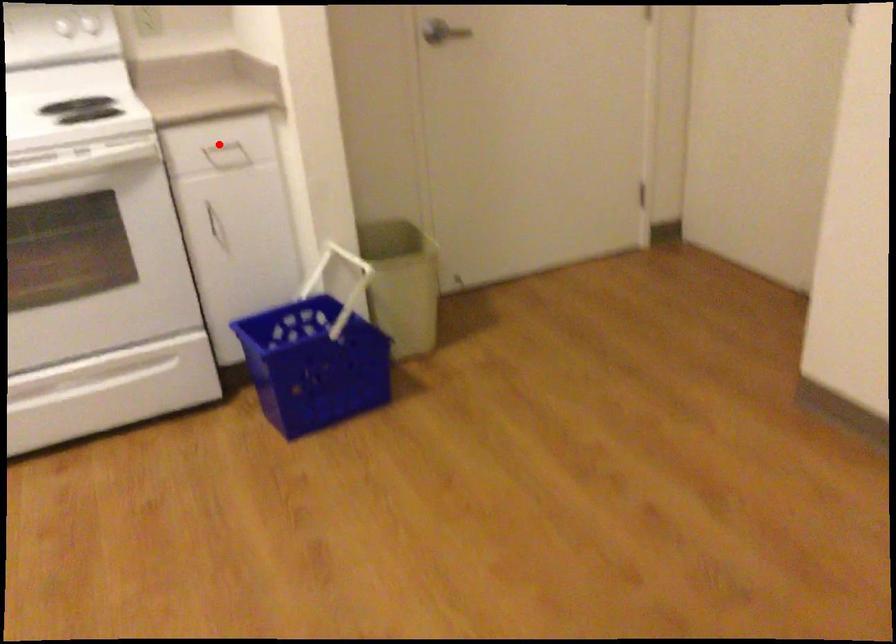
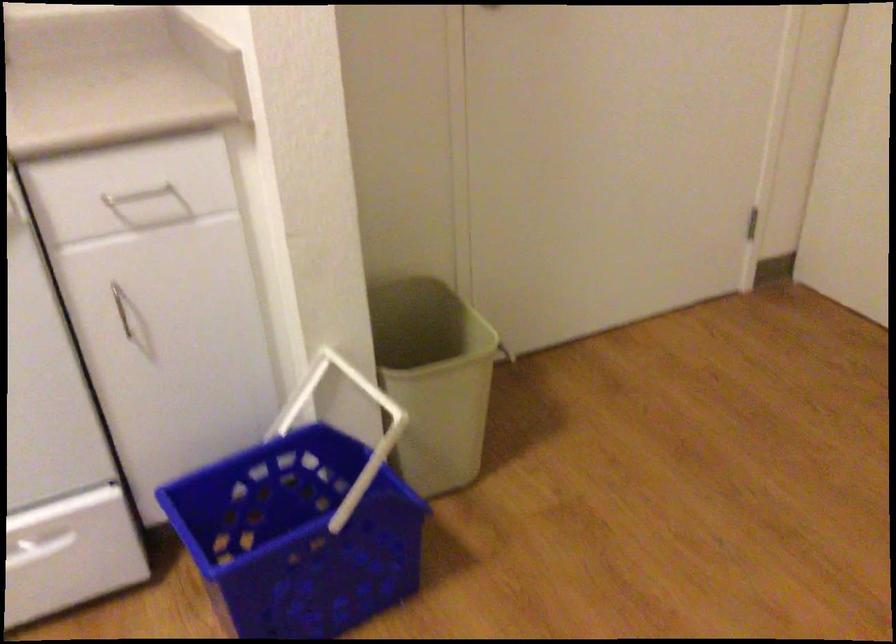
Locate, in the second image, the point that corresponds to the highlighted location in the first image.

(138, 194)